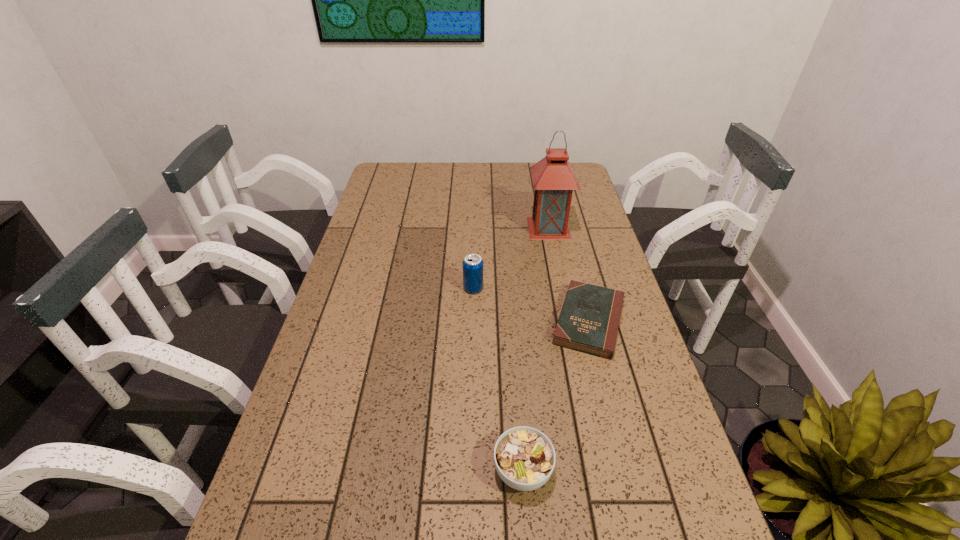
Image resolution: width=960 pixels, height=540 pixels. I want to click on lantern, so click(554, 179).

What are the coordinates of `the tallest object` in the screenshot? It's located at click(554, 179).

Identify the location of pop soda. The width and height of the screenshot is (960, 540). (472, 264).

Identify the location of the second tallest object. This screenshot has height=540, width=960. (472, 264).

Where is `the nearest object`? This screenshot has height=540, width=960. the nearest object is located at coordinates (524, 457).

At what (x,y) coordinates should I click in order to perform the action: click on soup bowl. Please return your answer as a coordinate pair (x, y). Looking at the image, I should click on (524, 457).

I want to click on the shortest object, so click(x=589, y=320).

Locate an element on the screen. The width and height of the screenshot is (960, 540). vacant area situated on the back of the farthest object is located at coordinates (542, 199).

Where is `vacant space located on the right of the pop soda`? This screenshot has height=540, width=960. vacant space located on the right of the pop soda is located at coordinates (521, 288).

Where is `free spot located on the back of the nearest object`? The height and width of the screenshot is (540, 960). free spot located on the back of the nearest object is located at coordinates (516, 372).